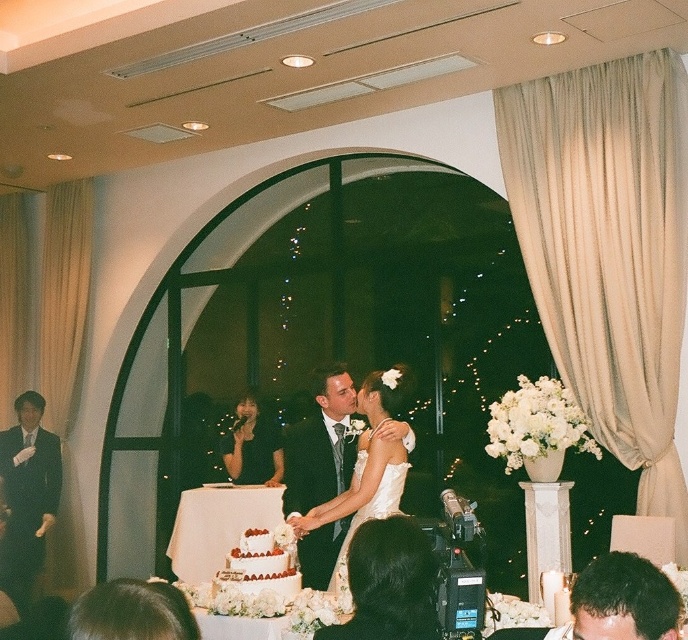
You are a photographer at the wedding. You need to adjust the camera focus to ensure both the matte black suit at center and the black suit at left are in focus. Which suit should you focus on first to account for their heights?

The matte black suit at center is shorter than the black suit at left. Therefore, you should focus on the matte black suit at center first to ensure proper depth of field for both subjects.

In the wedding scene, there is a point marked at coordinates (28, 496). Based on the scene description, what object or feature is located at this point?

The point at coordinates (28, 496) indicates the location of the black suit at left.

You are a photographer at the wedding. You need to capture a photo where both the black suit at left and the white textured cake at center are in focus. Which object should you focus on first to ensure both are sharp?

The black suit at left is taller than the white textured cake at center, so focusing on the taller object first would help ensure both are in focus.